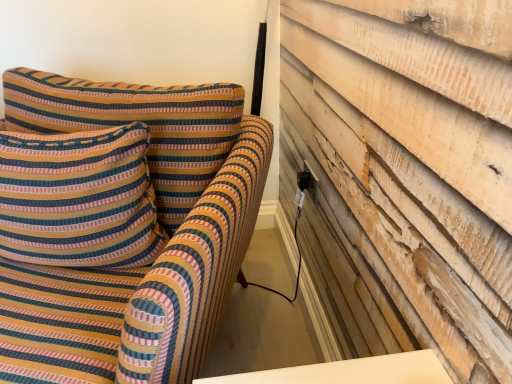
Question: Considering their positions, is striped fabric sofa at left located in front of or behind striped fabric pillow at upper left?

Choices:
 (A) front
 (B) behind

Answer: (A)

Question: Is striped fabric sofa at left bigger or smaller than striped fabric pillow at upper left?

Choices:
 (A) small
 (B) big

Answer: (B)

Question: Considering the real-world distances, which object is closest to the striped fabric pillow at upper left?

Choices:
 (A) striped fabric sofa at left
 (B) black plastic electric outlet at upper right

Answer: (A)

Question: Considering the real-world distances, which object is farthest from the black plastic electric outlet at upper right?

Choices:
 (A) striped fabric sofa at left
 (B) striped fabric pillow at upper left

Answer: (B)